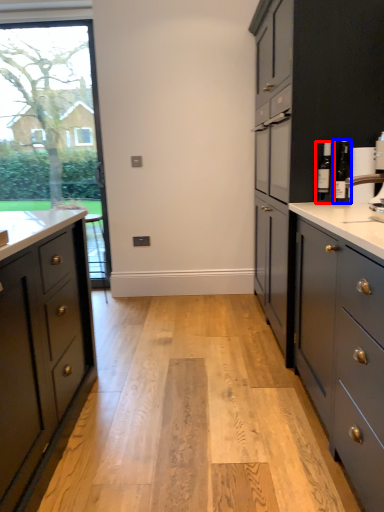
Question: Which point is further to the camera, bottle (highlighted by a red box) or bottle (highlighted by a blue box)?

Choices:
 (A) bottle
 (B) bottle

Answer: (A)